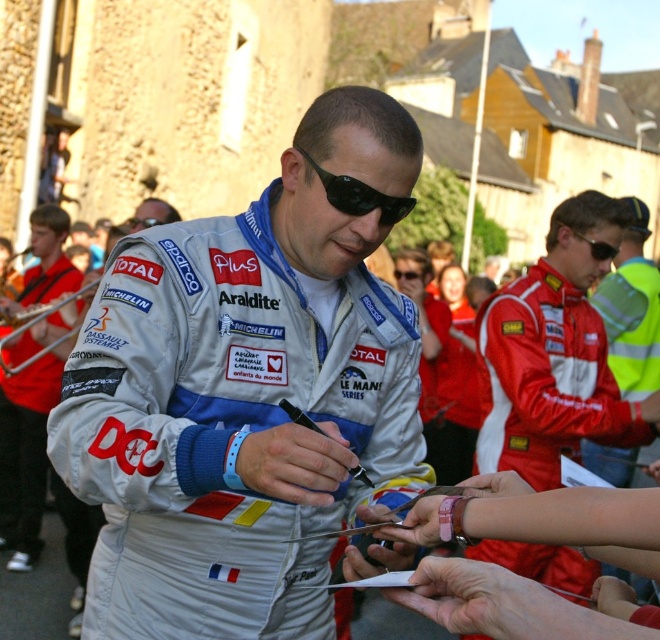
Question: In this image, where is silver metallic racing suit at center located relative to black matte sunglasses at center?

Choices:
 (A) above
 (B) below

Answer: (B)

Question: Is red reflective jacket at right in front of black plastic goggles at center?

Choices:
 (A) yes
 (B) no

Answer: (A)

Question: Where is red fabric jacket at center located in relation to smooth leather hand at center in the image?

Choices:
 (A) left
 (B) right

Answer: (B)

Question: Among these objects, which one is farthest from the camera?

Choices:
 (A) silver metallic racing suit at center
 (B) red fabric jacket at center

Answer: (B)

Question: Which object is closer to the camera taking this photo?

Choices:
 (A) smooth leather hand at center
 (B) red fabric jacket at center
 (C) black matte sunglasses at center
 (D) matte silver suit at center

Answer: (A)

Question: Based on their relative distances, which object is farther from the black plastic goggles at center?

Choices:
 (A) red reflective jacket at right
 (B) smooth leather hand at center

Answer: (B)